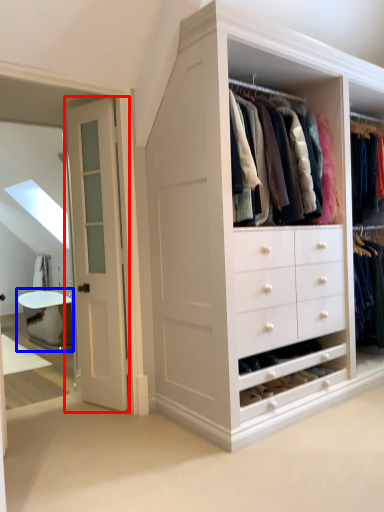
Question: Among these objects, which one is farthest to the camera, door (highlighted by a red box) or bath (highlighted by a blue box)?

Choices:
 (A) door
 (B) bath

Answer: (B)